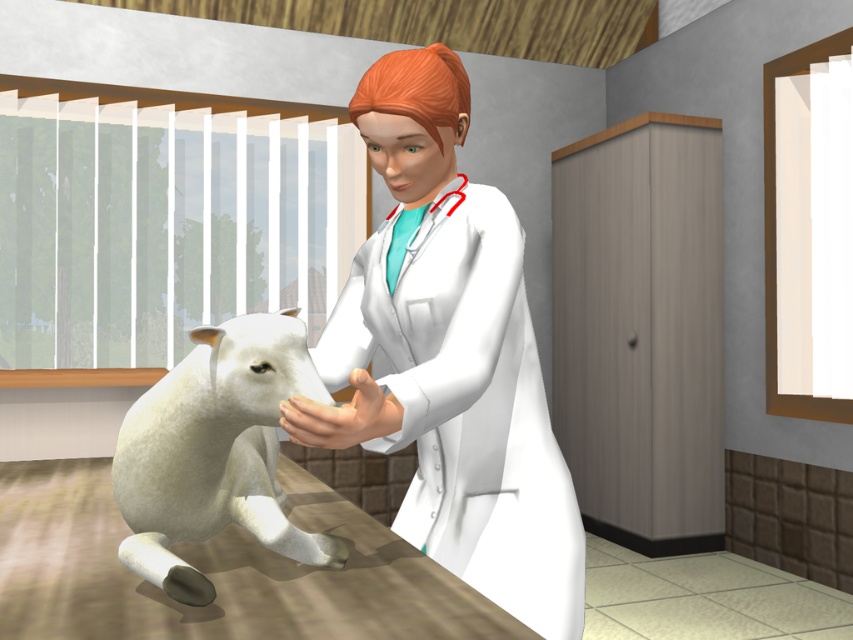
Question: Is white matte coat at center to the right of white woolen lamb at center from the viewer's perspective?

Choices:
 (A) yes
 (B) no

Answer: (A)

Question: Which object is farther from the camera taking this photo?

Choices:
 (A) white matte coat at center
 (B) white woolen lamb at center

Answer: (B)

Question: Is white matte coat at center to the left of white woolen lamb at center from the viewer's perspective?

Choices:
 (A) no
 (B) yes

Answer: (A)

Question: Does white matte coat at center have a larger size compared to white woolen lamb at center?

Choices:
 (A) yes
 (B) no

Answer: (A)